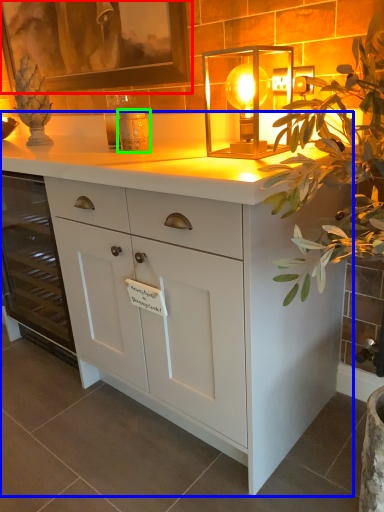
Question: Which object is the closest to the picture frame (highlighted by a red box)? Choose among these: chest of drawers (highlighted by a blue box) or candle holder (highlighted by a green box).

Choices:
 (A) chest of drawers
 (B) candle holder

Answer: (B)